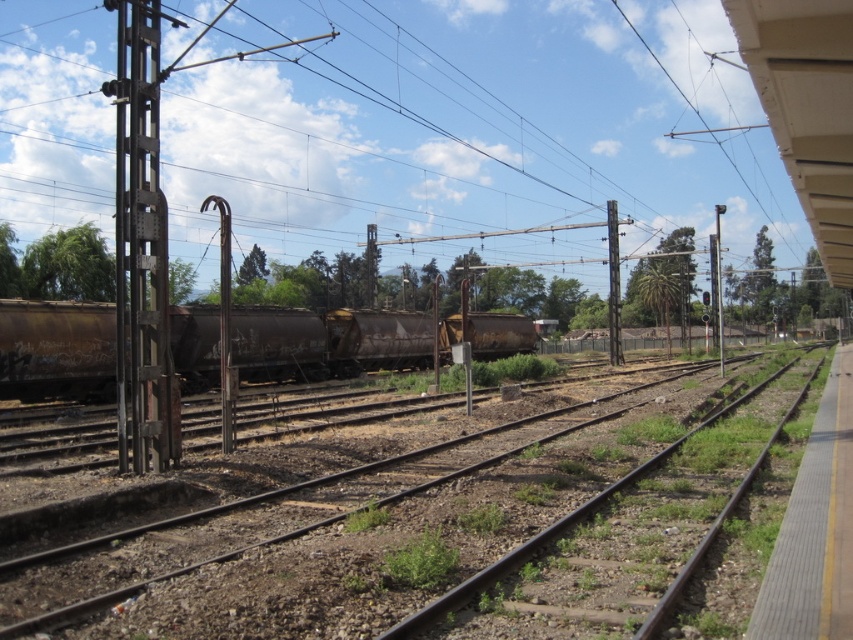
Consider the image. Which is more to the left, metallic power line at left or metallic pole at center?

metallic power line at left is more to the left.

Does point (329, 120) come farther from viewer compared to point (611, 305)?

Yes, point (329, 120) is farther from viewer.

You are a GUI agent. You are given a task and a screenshot of the screen. Output one action in this format:
    pyautogui.click(x=<x>, y=<y>)
    Task: Click on the metallic power line at left
    This screenshot has height=640, width=853.
    Given the screenshot: What is the action you would take?
    pyautogui.click(x=468, y=124)

Does green grassy train track at center appear on the right side of metallic gray pole at left?

Indeed, green grassy train track at center is positioned on the right side of metallic gray pole at left.

Does green grassy train track at center have a larger size compared to metallic gray pole at left?

No, green grassy train track at center is not bigger than metallic gray pole at left.

Who is more forward, (x=468, y=588) or (x=131, y=33)?

Point (x=468, y=588)

The image size is (853, 640). Find the location of `green grassy train track at center`. green grassy train track at center is located at coordinates (616, 536).

Between point (764, 433) and point (611, 285), which one is positioned behind?

The point (611, 285) is more distant.

Which is more to the left, green grassy train track at center or metallic pole at center?

green grassy train track at center

Does point (718, 451) lie in front of point (608, 344)?

Yes, point (718, 451) is in front of point (608, 344).

What are the coordinates of `green grassy train track at center` in the screenshot? It's located at (616, 536).